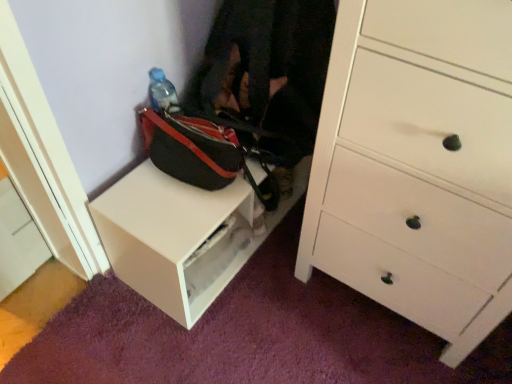
Question: From a real-world perspective, is white matte table at lower left positioned under black fabric bag at center based on gravity?

Choices:
 (A) no
 (B) yes

Answer: (B)

Question: Would you say white matte table at lower left is a long distance from black fabric bag at center?

Choices:
 (A) yes
 (B) no

Answer: (B)

Question: From a real-world perspective, is white matte table at lower left on black fabric bag at center?

Choices:
 (A) yes
 (B) no

Answer: (B)

Question: Can you confirm if white matte table at lower left is positioned to the right of black fabric bag at center?

Choices:
 (A) no
 (B) yes

Answer: (A)

Question: Is white matte table at lower left thinner than black fabric bag at center?

Choices:
 (A) no
 (B) yes

Answer: (B)

Question: Choose the correct answer: Is white matte table at lower left inside white wood chest of drawers at center right or outside it?

Choices:
 (A) inside
 (B) outside

Answer: (B)

Question: Visually, is white matte table at lower left positioned to the left or to the right of white wood chest of drawers at center right?

Choices:
 (A) left
 (B) right

Answer: (A)

Question: From a real-world perspective, relative to white wood chest of drawers at center right, is white matte table at lower left vertically above or below?

Choices:
 (A) above
 (B) below

Answer: (B)

Question: Considering the positions of white matte table at lower left and white wood chest of drawers at center right in the image, is white matte table at lower left taller or shorter than white wood chest of drawers at center right?

Choices:
 (A) short
 (B) tall

Answer: (A)

Question: Visually, is white wood chest of drawers at center right positioned to the left or to the right of white matte table at lower left?

Choices:
 (A) right
 (B) left

Answer: (A)

Question: Is white wood chest of drawers at center right inside the boundaries of white matte table at lower left, or outside?

Choices:
 (A) outside
 (B) inside

Answer: (A)

Question: From a real-world perspective, is white wood chest of drawers at center right positioned above or below white matte table at lower left?

Choices:
 (A) below
 (B) above

Answer: (B)

Question: From the image's perspective, is white wood chest of drawers at center right located above or below white matte table at lower left?

Choices:
 (A) below
 (B) above

Answer: (B)

Question: Is white matte table at lower left in front of or behind black fabric bag at center in the image?

Choices:
 (A) behind
 (B) front

Answer: (A)

Question: Considering the positions of white matte table at lower left and black fabric bag at center in the image, is white matte table at lower left taller or shorter than black fabric bag at center?

Choices:
 (A) short
 (B) tall

Answer: (A)